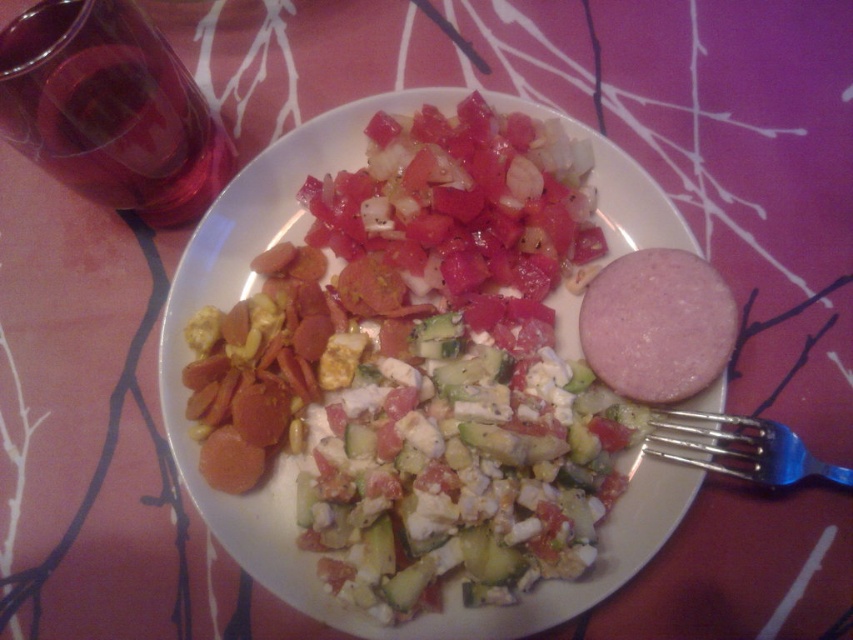
You have a small toy car that is 10 cm long. You want to place it on the table without it overlapping any objects. The table has the white ceramic plate at center and the blue metallic fork at lower right. Which object should you avoid placing the toy car near to ensure it fits?

The white ceramic plate at center is bigger than the blue metallic fork at lower right, so you should avoid placing the toy car near the white ceramic plate at center to ensure there is enough space.

You are sitting at the table with the red tablecloth and want to reach for an item. You notice two points marked on the table. The first point is at coordinate point(115, 131) and the second is at point(639, 372). Which point is closer to you?

Point(115, 131) is closer to you because it is in front of point(639, 372).